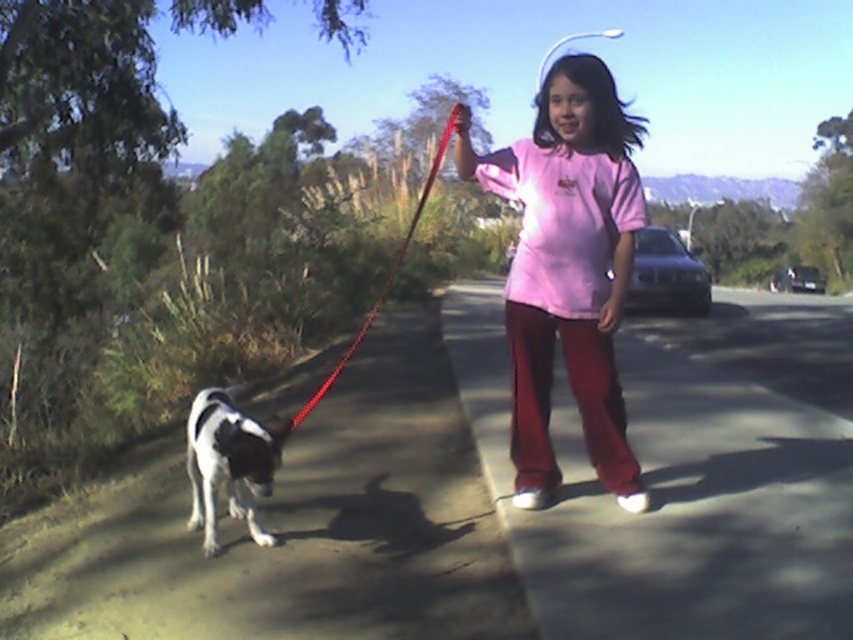
This screenshot has width=853, height=640. In order to click on smooth asphalt road at center in this screenshot , I will do `click(669, 497)`.

Who is more distant from viewer, (718, 596) or (512, 266)?

The point (512, 266) is behind.

Who is more distant from viewer, (x=727, y=516) or (x=538, y=380)?

The point (x=538, y=380) is behind.

Where is `smooth asphalt road at center`? smooth asphalt road at center is located at coordinates (669, 497).

Between smooth concrete path at lower left and black and white fur at lower left, which one appears on the right side from the viewer's perspective?

From the viewer's perspective, smooth concrete path at lower left appears more on the right side.

Based on the photo, is smooth concrete path at lower left thinner than black and white fur at lower left?

Incorrect, smooth concrete path at lower left's width is not less than black and white fur at lower left's.

The height and width of the screenshot is (640, 853). I want to click on smooth concrete path at lower left, so click(289, 529).

The width and height of the screenshot is (853, 640). I want to click on smooth concrete path at lower left, so click(x=289, y=529).

Looking at this image, who is positioned more to the right, black and white fur at lower left or red nylon leash at center?

Positioned to the right is red nylon leash at center.

Based on the photo, does black and white fur at lower left have a lesser width compared to red nylon leash at center?

Yes, black and white fur at lower left is thinner than red nylon leash at center.

Who is more forward, (198, 525) or (306, 406)?

Point (198, 525)

Locate an element on the screen. The height and width of the screenshot is (640, 853). black and white fur at lower left is located at coordinates (228, 464).